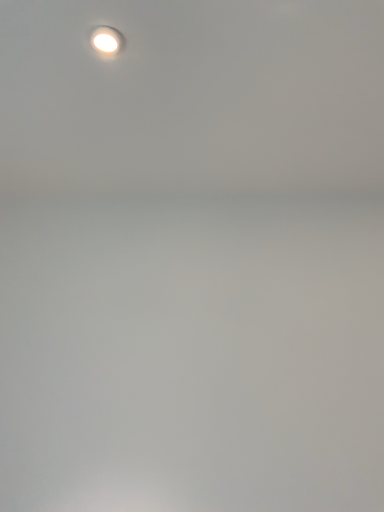
What do you see at coordinates (107, 40) in the screenshot? This screenshot has width=384, height=512. I see `white glossy droplight at upper left` at bounding box center [107, 40].

In order to click on white glossy droplight at upper left in this screenshot , I will do (107, 40).

Where is `white glossy droplight at upper left`? white glossy droplight at upper left is located at coordinates (107, 40).